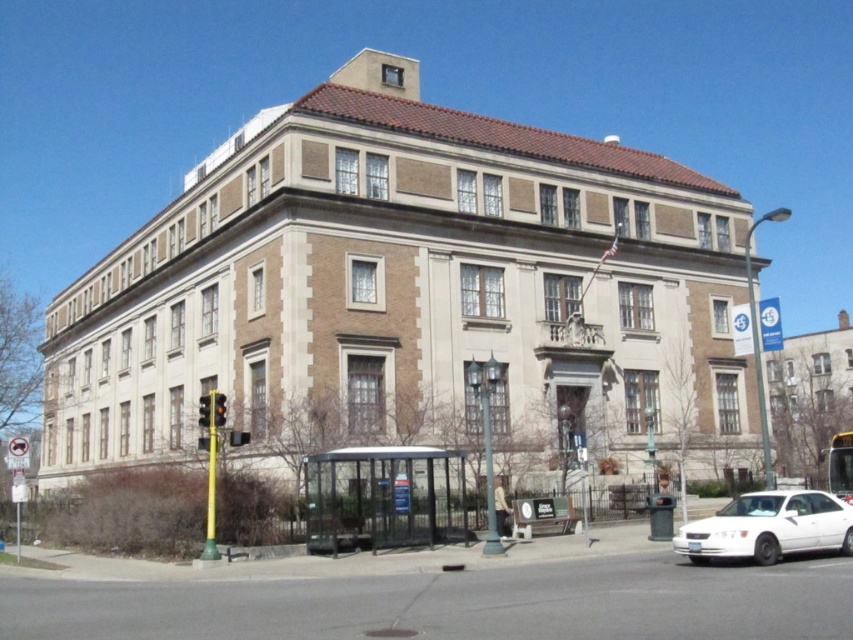
Can you confirm if metallic silver bench at lower center is smaller than metallic traffic light at center-left?

Yes.

Based on the photo, can you confirm if metallic silver bench at lower center is wider than metallic traffic light at center-left?

Incorrect, metallic silver bench at lower center's width does not surpass metallic traffic light at center-left's.

Between point (514, 524) and point (206, 422), which one is positioned behind?

Positioned behind is point (514, 524).

The height and width of the screenshot is (640, 853). I want to click on metallic silver bench at lower center, so click(x=543, y=515).

Is white glossy sedan at lower right positioned before metallic traffic light at center-left?

Yes, white glossy sedan at lower right is closer to the viewer.

Can you confirm if white glossy sedan at lower right is shorter than metallic traffic light at center-left?

Incorrect, white glossy sedan at lower right's height does not fall short of metallic traffic light at center-left's.

Is point (741, 540) positioned after point (206, 413)?

No.

Find the location of a particular element. Image resolution: width=853 pixels, height=640 pixels. white glossy sedan at lower right is located at coordinates (769, 528).

Is metallic silver bus at center thinner than metallic traffic light at center-left?

In fact, metallic silver bus at center might be wider than metallic traffic light at center-left.

Who is positioned more to the left, metallic silver bus at center or metallic traffic light at center-left?

From the viewer's perspective, metallic traffic light at center-left appears more on the left side.

Image resolution: width=853 pixels, height=640 pixels. What are the coordinates of `metallic silver bus at center` in the screenshot? It's located at (840, 465).